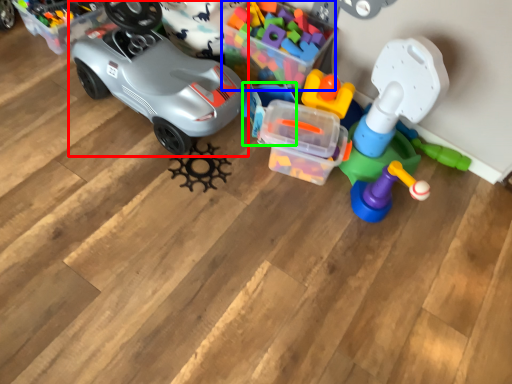
Question: Which is farther away from car (highlighted by a red box)? toy (highlighted by a blue box) or toy (highlighted by a green box)?

Choices:
 (A) toy
 (B) toy

Answer: (A)